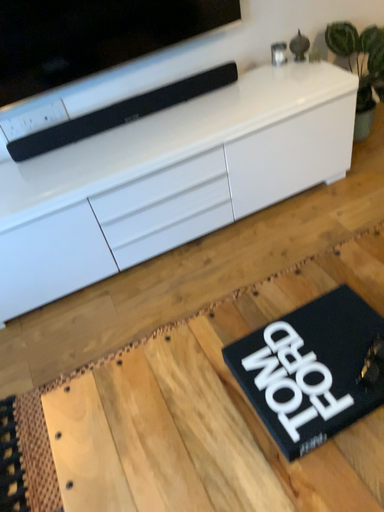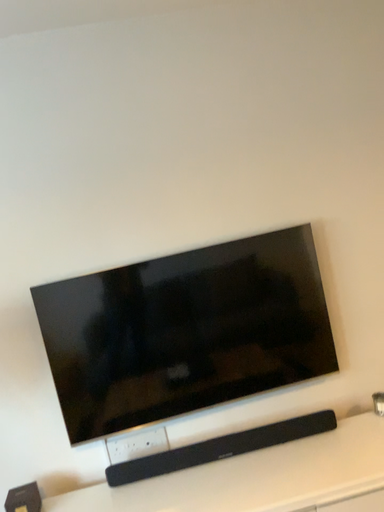
Question: How did the camera likely rotate when shooting the video?

Choices:
 (A) rotated downward
 (B) rotated upward

Answer: (B)